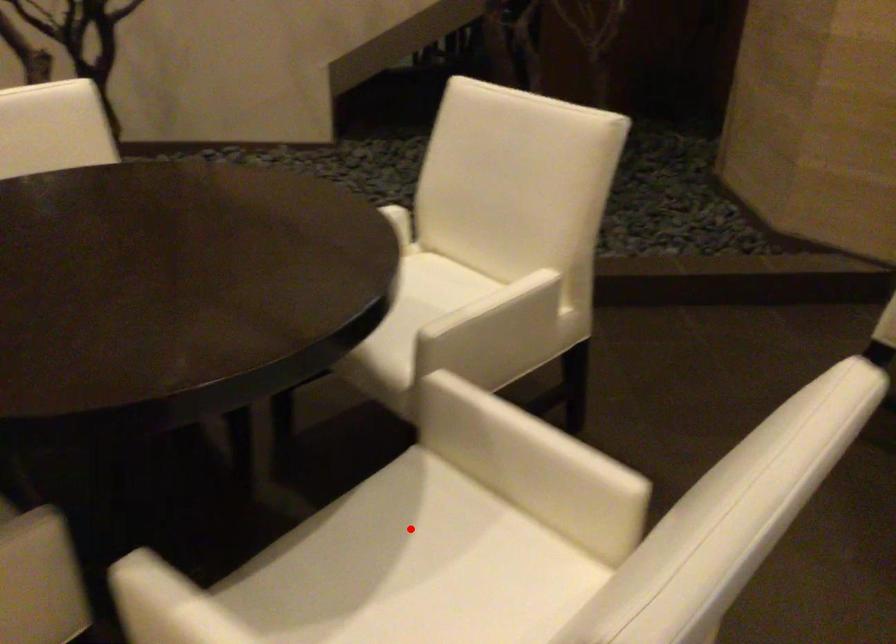
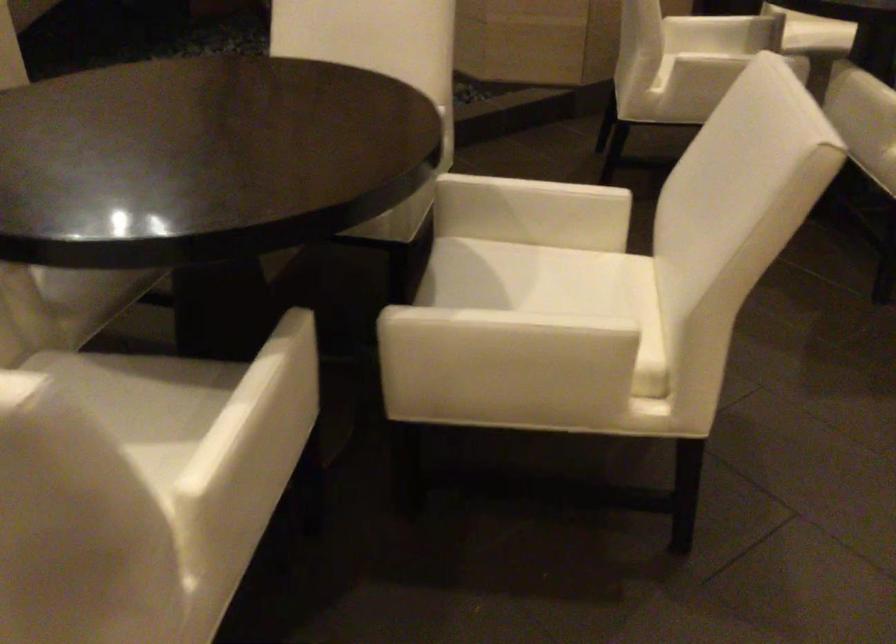
Locate, in the second image, the point that corresponds to the highlighted location in the first image.

(490, 272)